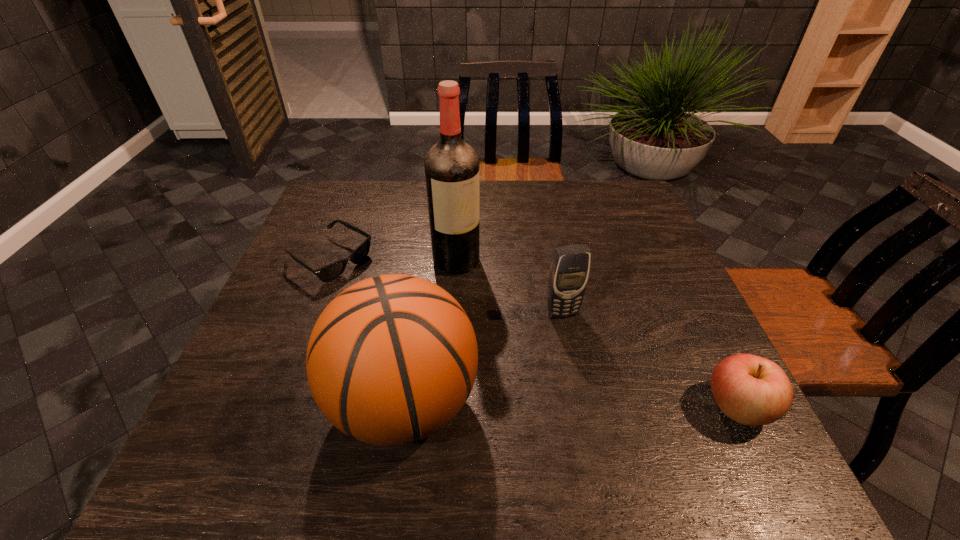
You are a GUI agent. You are given a task and a screenshot of the screen. Output one action in this format:
    pyautogui.click(x=<x>, y=<y>)
    Task: Click on the object present at the left edge
    The image size is (960, 540).
    Given the screenshot: What is the action you would take?
    pyautogui.click(x=327, y=273)

Where is `object that is at the right edge`? The height and width of the screenshot is (540, 960). object that is at the right edge is located at coordinates (751, 390).

I want to click on object at the near right corner, so click(x=751, y=390).

The width and height of the screenshot is (960, 540). What are the coordinates of `free space at the far edge of the desktop` in the screenshot? It's located at (382, 208).

This screenshot has width=960, height=540. Identify the location of vacant space at the near edge of the desktop. (643, 418).

I want to click on vacant space at the left edge of the desktop, so click(x=298, y=282).

The width and height of the screenshot is (960, 540). Find the location of `blank space at the right edge of the desktop`. blank space at the right edge of the desktop is located at coordinates (639, 238).

This screenshot has width=960, height=540. What are the coordinates of `free region at the far left corner of the desktop` in the screenshot? It's located at (369, 188).

The width and height of the screenshot is (960, 540). What are the coordinates of `free spot at the near left corner of the desktop` in the screenshot? It's located at (243, 393).

Where is `vacant space at the far right corner of the desktop`? This screenshot has height=540, width=960. vacant space at the far right corner of the desktop is located at coordinates (627, 187).